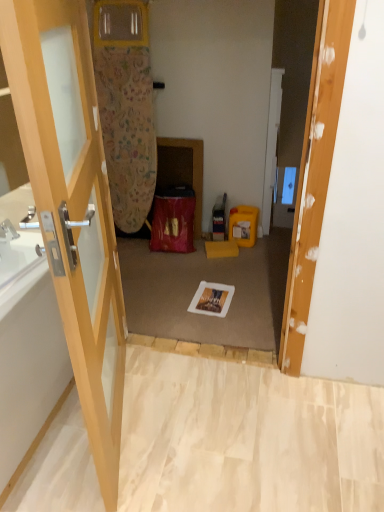
Question: Considering the relative sizes of yellow plastic box at center-right and white glossy door at center, the second door in the left-to-right sequence, in the image provided, is yellow plastic box at center-right taller than white glossy door at center, the second door in the left-to-right sequence,?

Choices:
 (A) no
 (B) yes

Answer: (A)

Question: Does yellow plastic box at center-right have a smaller size compared to white glossy door at center, the second door in the left-to-right sequence?

Choices:
 (A) yes
 (B) no

Answer: (B)

Question: Considering the relative sizes of yellow plastic box at center-right and white glossy door at center, positioned as the 2th door in front-to-back order, in the image provided, is yellow plastic box at center-right bigger than white glossy door at center, positioned as the 2th door in front-to-back order,?

Choices:
 (A) yes
 (B) no

Answer: (A)

Question: From a real-world perspective, does yellow plastic box at center-right sit lower than white glossy door at center, acting as the 1th door starting from the back?

Choices:
 (A) yes
 (B) no

Answer: (A)

Question: Can we say yellow plastic box at center-right lies outside white glossy door at center, acting as the 1th door starting from the back?

Choices:
 (A) no
 (B) yes

Answer: (B)

Question: Is white glossy bathtub at left in front of or behind wooden door at center, which ranks as the 1th door in left-to-right order, in the image?

Choices:
 (A) behind
 (B) front

Answer: (A)

Question: Do you think white glossy bathtub at left is within wooden door at center, the second door from the back, or outside of it?

Choices:
 (A) outside
 (B) inside

Answer: (A)

Question: Is point (26, 339) closer or farther from the camera than point (115, 313)?

Choices:
 (A) closer
 (B) farther

Answer: (A)

Question: From the image's perspective, is white glossy bathtub at left located above or below wooden door at center, which ranks as the 1th door in left-to-right order?

Choices:
 (A) above
 (B) below

Answer: (B)

Question: From the image's perspective, is white glossy door at center, positioned as the 2th door in front-to-back order, positioned above or below white glossy bathtub at left?

Choices:
 (A) above
 (B) below

Answer: (A)

Question: Considering the relative positions of white glossy door at center, the second door in the left-to-right sequence, and white glossy bathtub at left in the image provided, is white glossy door at center, the second door in the left-to-right sequence, to the left or to the right of white glossy bathtub at left?

Choices:
 (A) right
 (B) left

Answer: (A)

Question: Considering their positions, is white glossy door at center, the second door in the left-to-right sequence, located in front of or behind white glossy bathtub at left?

Choices:
 (A) front
 (B) behind

Answer: (B)

Question: From their relative heights in the image, would you say white glossy door at center, the second door in the left-to-right sequence, is taller or shorter than white glossy bathtub at left?

Choices:
 (A) tall
 (B) short

Answer: (A)

Question: From a real-world perspective, relative to yellow plastic box at center-right, is wooden door at center, the second door from the back, vertically above or below?

Choices:
 (A) above
 (B) below

Answer: (A)

Question: Relative to yellow plastic box at center-right, is wooden door at center, positioned as the first door in front-to-back order, in front or behind?

Choices:
 (A) front
 (B) behind

Answer: (A)